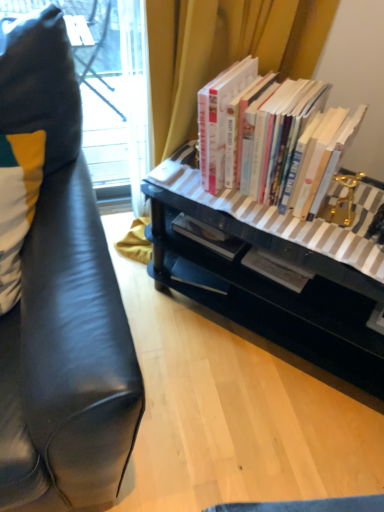
Measure the distance between point (4,197) and camera.

Point (4,197) and camera are 88.50 centimeters apart from each other.

Describe the element at coordinates (267, 295) in the screenshot. I see `black glossy desk at center` at that location.

Identify the location of hardcover books at center. (279, 139).

In order to click on white and yellow fabric pillow at left in this screenshot , I will do `click(32, 128)`.

From the picture: Can you confirm if hardcover books at center is shorter than black glossy desk at center?

Correct, hardcover books at center is not as tall as black glossy desk at center.

Can you confirm if hardcover books at center is smaller than black glossy desk at center?

Yes.

The width and height of the screenshot is (384, 512). What are the coordinates of `book on the left of the black glossy desk at center` in the screenshot? It's located at (279, 139).

Does hardcover books at center contain black glossy desk at center?

Actually, black glossy desk at center is outside hardcover books at center.

Is hardcover books at center at the back of black glossy desk at center?

black glossy desk at center does not have its back to hardcover books at center.

Considering the positions of objects black glossy desk at center and hardcover books at center in the image provided, who is behind, black glossy desk at center or hardcover books at center?

hardcover books at center is more distant.

Can you confirm if black glossy desk at center is shorter than hardcover books at center?

Incorrect, the height of black glossy desk at center does not fall short of that of hardcover books at center.

Which is in front, point (186, 249) or point (243, 170)?

The point (243, 170) is in front.

Considering the relative positions of hardcover books at center and white and yellow fabric pillow at left in the image provided, is hardcover books at center to the left or to the right of white and yellow fabric pillow at left?

In the image, hardcover books at center appears on the right side of white and yellow fabric pillow at left.

From the image's perspective, is hardcover books at center positioned above or below white and yellow fabric pillow at left?

Based on their image positions, hardcover books at center is located above white and yellow fabric pillow at left.

Is hardcover books at center oriented away from white and yellow fabric pillow at left?

No, hardcover books at center is not facing away from white and yellow fabric pillow at left.

You are a GUI agent. You are given a task and a screenshot of the screen. Output one action in this format:
    pyautogui.click(x=<x>, y=<y>)
    Task: Click on the desk that appears on the right of white and yellow fabric pillow at left
    
    Given the screenshot: What is the action you would take?
    pyautogui.click(x=267, y=295)

From a real-world perspective, is white and yellow fabric pillow at left located higher than black glossy desk at center?

Yes.

Between white and yellow fabric pillow at left and black glossy desk at center, which one appears on the right side from the viewer's perspective?

black glossy desk at center is more to the right.

Which is in front, point (224, 292) or point (53, 146)?

The point (53, 146) is more forward.

What's the angular difference between black glossy desk at center and white and yellow fabric pillow at left's facing directions?

The angular difference between black glossy desk at center and white and yellow fabric pillow at left is 45.1 degrees.

Find the location of a particular element. This screenshot has height=512, width=384. pillow that appears on the left of black glossy desk at center is located at coordinates (32, 128).

Is white and yellow fabric pillow at left located within black glossy desk at center?

Definitely not — white and yellow fabric pillow at left is not inside black glossy desk at center.

From the picture: Could you tell me if white and yellow fabric pillow at left is turned towards hardcover books at center?

No, white and yellow fabric pillow at left is not turned towards hardcover books at center.

Is white and yellow fabric pillow at left to the left or to the right of hardcover books at center in the image?

Based on their positions, white and yellow fabric pillow at left is located to the left of hardcover books at center.

In the scene shown: Considering the relative sizes of white and yellow fabric pillow at left and hardcover books at center in the image provided, is white and yellow fabric pillow at left taller than hardcover books at center?

Yes, white and yellow fabric pillow at left is taller than hardcover books at center.

From a real-world perspective, is white and yellow fabric pillow at left above or below hardcover books at center?

In terms of real-world spatial position, white and yellow fabric pillow at left is above hardcover books at center.

The width and height of the screenshot is (384, 512). What are the coordinates of `desk below the hardcover books at center (from the image's perspective)` in the screenshot? It's located at click(267, 295).

Identify the location of book that appears behind the black glossy desk at center. (279, 139).

Considering their positions, is hardcover books at center positioned closer to white and yellow fabric pillow at left than black glossy desk at center?

Based on the image, hardcover books at center appears to be nearer to white and yellow fabric pillow at left.

Which object lies nearer to the anchor point hardcover books at center, black glossy desk at center or white and yellow fabric pillow at left?

black glossy desk at center lies closer to hardcover books at center than the other object.

From the image, which object appears to be farther from black glossy desk at center, hardcover books at center or white and yellow fabric pillow at left?

The object further to black glossy desk at center is white and yellow fabric pillow at left.

Based on their spatial positions, is white and yellow fabric pillow at left or black glossy desk at center closer to hardcover books at center?

black glossy desk at center lies closer to hardcover books at center than the other object.

Considering their positions, is black glossy desk at center positioned further to white and yellow fabric pillow at left than hardcover books at center?

black glossy desk at center is positioned further to the anchor white and yellow fabric pillow at left.

Which object lies nearer to the anchor point black glossy desk at center, white and yellow fabric pillow at left or hardcover books at center?

The object closer to black glossy desk at center is hardcover books at center.

I want to click on book between white and yellow fabric pillow at left and black glossy desk at center from left to right, so click(279, 139).